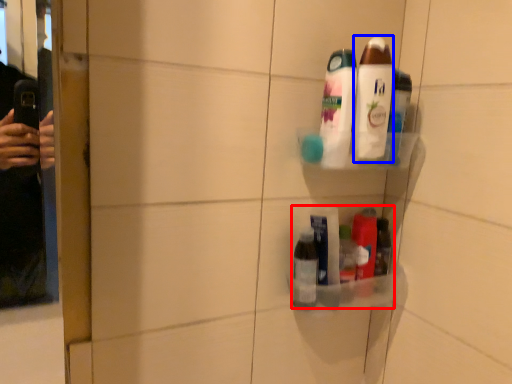
Question: Among these objects, which one is farthest to the camera, product (highlighted by a red box) or toiletry (highlighted by a blue box)?

Choices:
 (A) product
 (B) toiletry

Answer: (A)